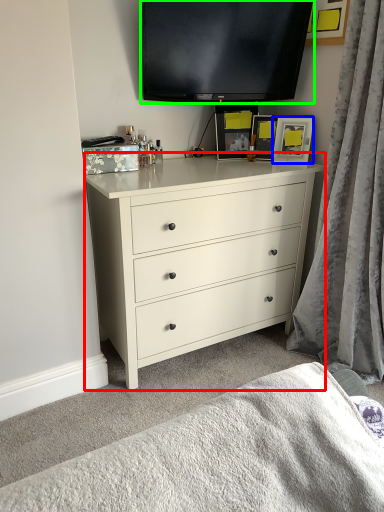
Question: Considering the real-world distances, which object is farthest from chest of drawers (highlighted by a red box)? picture frame (highlighted by a blue box) or television (highlighted by a green box)?

Choices:
 (A) picture frame
 (B) television

Answer: (B)